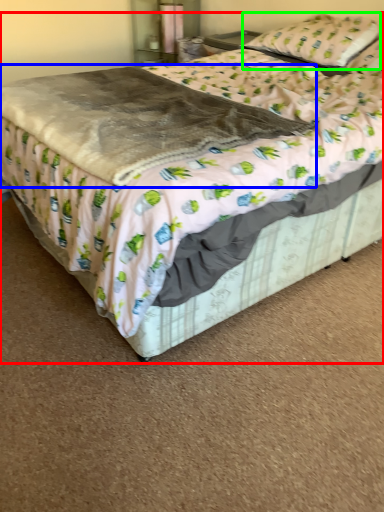
Question: Considering the real-world distances, which object is farthest from bed (highlighted by a red box)? blanket (highlighted by a blue box) or pillow (highlighted by a green box)?

Choices:
 (A) blanket
 (B) pillow

Answer: (B)